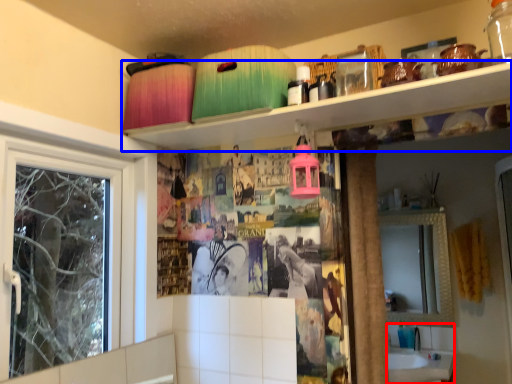
Question: Which point is closer to the camera, sink (highlighted by a red box) or shelf (highlighted by a blue box)?

Choices:
 (A) sink
 (B) shelf

Answer: (B)